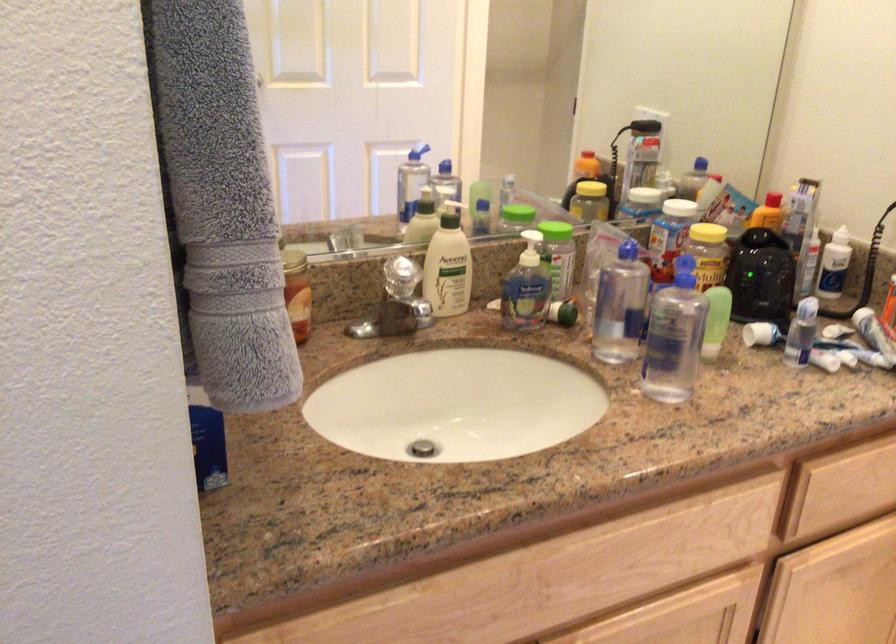
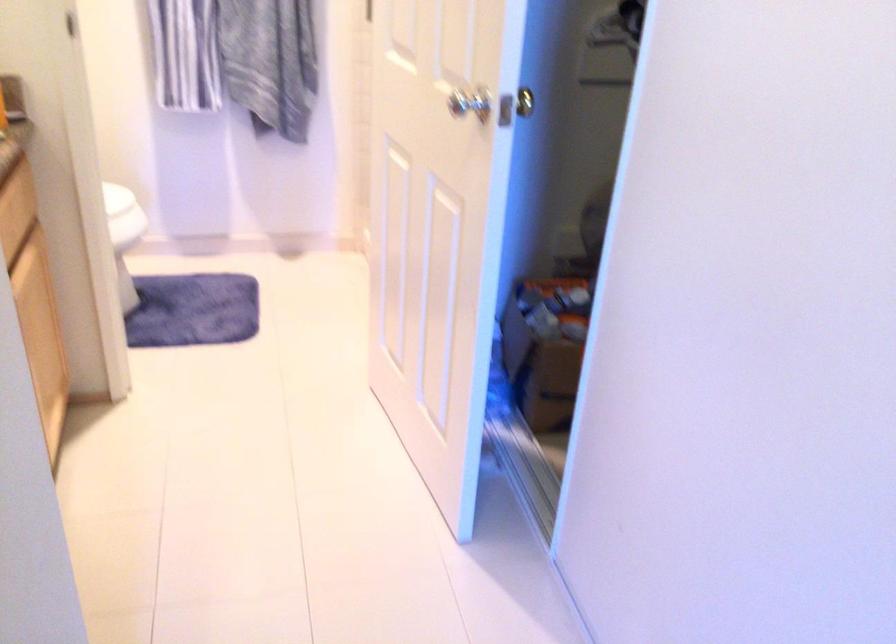
Locate, in the second image, the point that corresponds to point 823,484 in the first image.

(12, 229)